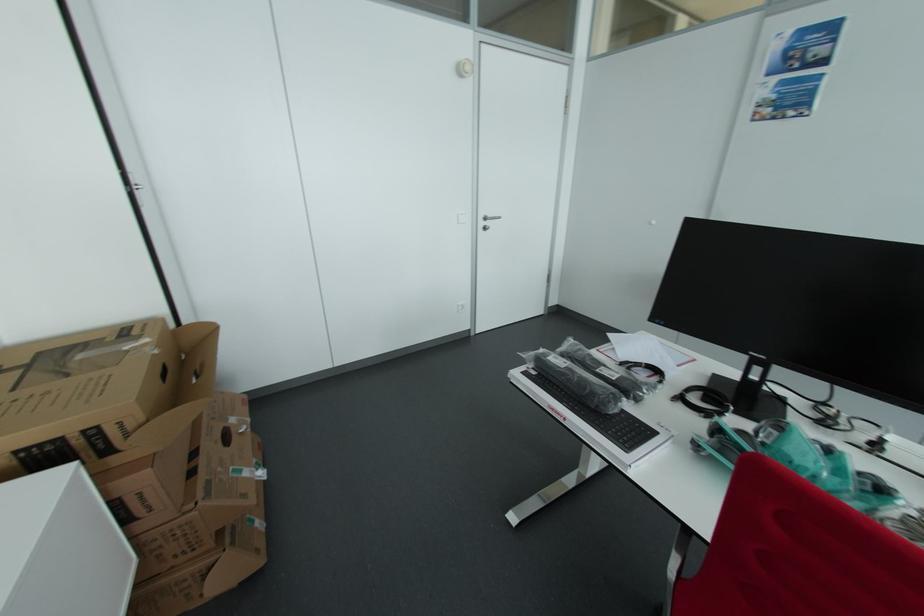
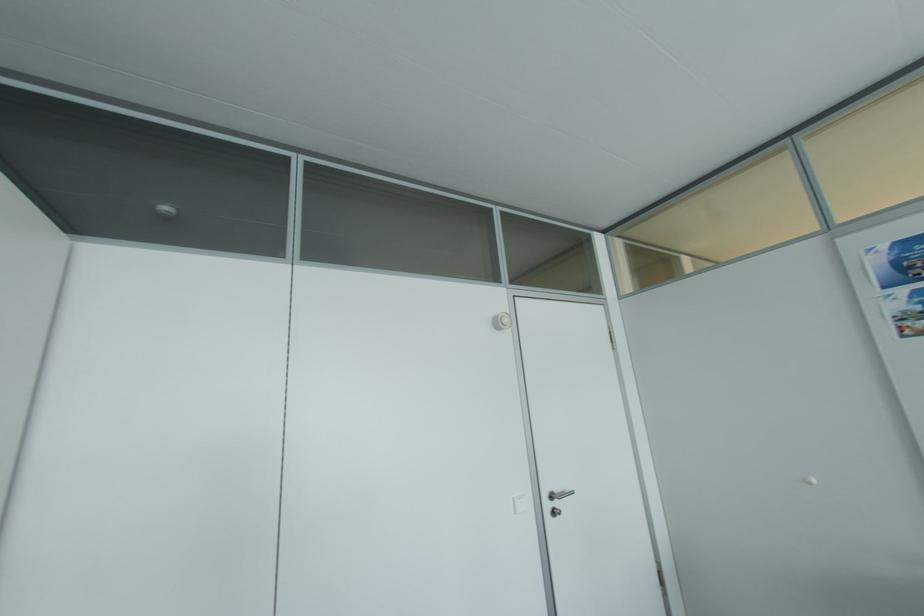
Question: The first image is from the beginning of the video and the second image is from the end. How did the camera likely rotate when shooting the video?

Choices:
 (A) Left
 (B) Right
 (C) Up
 (D) Down

Answer: (C)